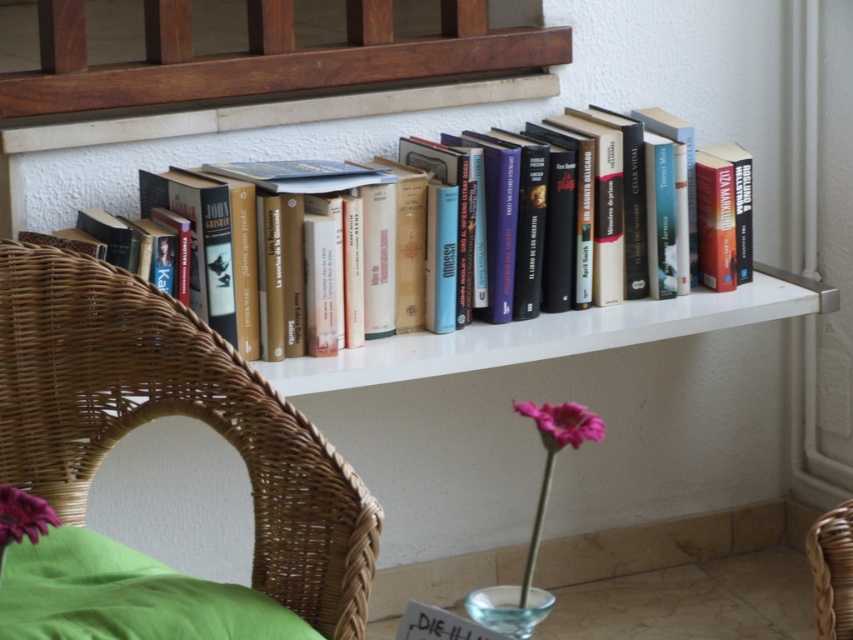
From the picture: Can you confirm if wooden at upper center is positioned to the right of transparent glass vase at lower center?

In fact, wooden at upper center is to the left of transparent glass vase at lower center.

Is wooden at upper center thinner than transparent glass vase at lower center?

No.

Is point (471, 61) farther from viewer compared to point (486, 618)?

Yes.

Find the location of a particular element. Image resolution: width=853 pixels, height=640 pixels. wooden at upper center is located at coordinates (263, 56).

Does white glossy shelf at center appear on the right side of pink matte flower at lower center?

Correct, you'll find white glossy shelf at center to the right of pink matte flower at lower center.

I want to click on white glossy shelf at center, so click(550, 336).

Which is in front, point (682, 284) or point (189, 618)?

Point (189, 618) is in front.

Is hardcover books at center smaller than green fabric pillow at lower left?

No, hardcover books at center is not smaller than green fabric pillow at lower left.

Does point (263, 330) lie in front of point (25, 540)?

No, (263, 330) is further to viewer.

In order to click on hardcover books at center in this screenshot , I will do `click(550, 218)`.